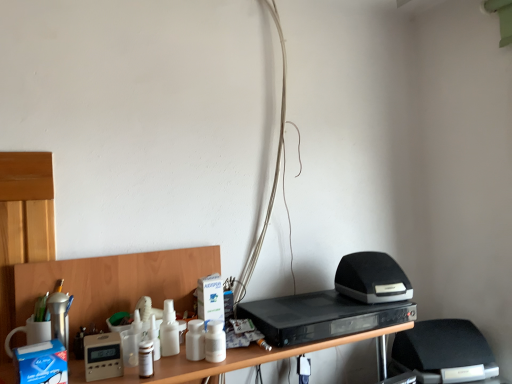
Question: Considering their positions, is black matte speaker at right, which appears as the second appliance when viewed from the left, located in front of or behind black plastic dvd player at center?

Choices:
 (A) behind
 (B) front

Answer: (A)

Question: From a real-world perspective, is black matte speaker at right, which is the second appliance from bottom to top, physically located above or below black plastic dvd player at center?

Choices:
 (A) below
 (B) above

Answer: (B)

Question: Based on their relative distances, which object is nearer to the black matte speaker at right, which appears as the second appliance when viewed from the left?

Choices:
 (A) black fabric computer chair at lower right
 (B) black plastic dvd player at center
 (C) white matte wires at center
 (D) beige plastic thermostat at lower left, which appears as the 2th appliance when viewed from the right

Answer: (B)

Question: Considering the real-world distances, which object is farthest from the beige plastic thermostat at lower left, the 2th appliance positioned from the back?

Choices:
 (A) black fabric computer chair at lower right
 (B) black matte speaker at right, marked as the second appliance in a front-to-back arrangement
 (C) black plastic dvd player at center
 (D) white matte wires at center

Answer: (A)